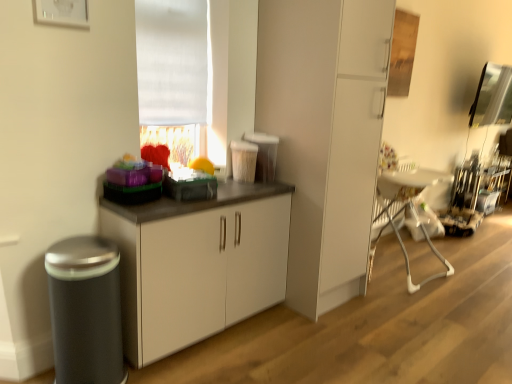
This screenshot has width=512, height=384. In order to click on free point to the right of white matte cabinet at center, which appears as the second cabinetry when viewed from the left in this screenshot , I will do `click(395, 301)`.